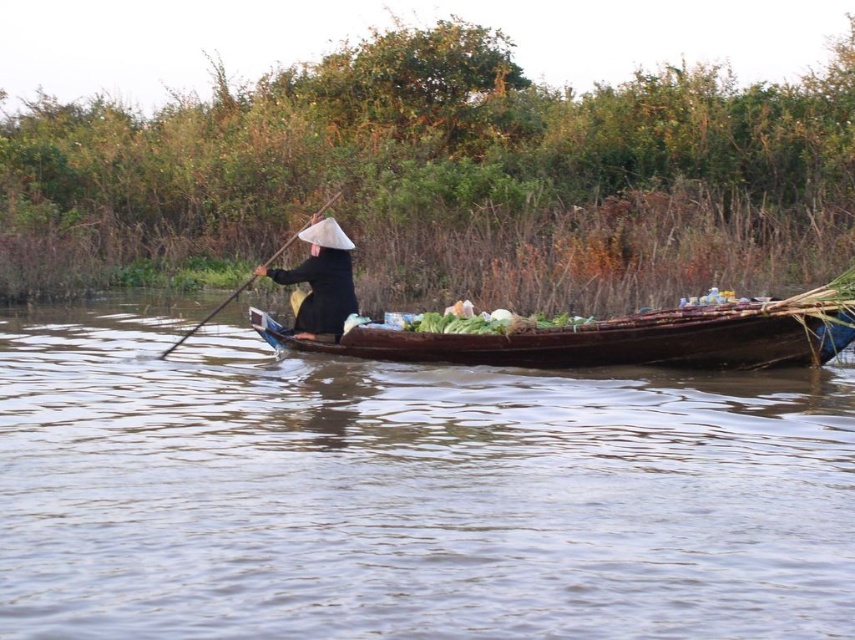
Describe the element at coordinates (405, 490) in the screenshot. I see `brown wooden boat at center` at that location.

Which is below, brown wooden boat at center or green leafy vegetables at center?

Positioned lower is brown wooden boat at center.

Describe the element at coordinates (405, 490) in the screenshot. I see `brown wooden boat at center` at that location.

Where is `brown wooden boat at center`? brown wooden boat at center is located at coordinates (405, 490).

Based on the photo, who is more forward, [310,352] or [432,324]?

Point [432,324]

Does brown wooden canoe at center have a greater height compared to green leafy vegetables at center?

Correct, brown wooden canoe at center is much taller as green leafy vegetables at center.

Between point (711, 324) and point (460, 308), which one is positioned in front?

Point (711, 324) is in front.

At what (x,y) coordinates should I click in order to perform the action: click on brown wooden canoe at center. Please return your answer as a coordinate pair (x, y). The width and height of the screenshot is (855, 640). Looking at the image, I should click on (606, 340).

Is brown wooden canoe at center wider than black matte conical hat at center?

Yes, brown wooden canoe at center is wider than black matte conical hat at center.

Does brown wooden canoe at center appear under black matte conical hat at center?

Correct, brown wooden canoe at center is located below black matte conical hat at center.

Which is in front, point (739, 310) or point (337, 300)?

Point (739, 310)

The image size is (855, 640). I want to click on brown wooden canoe at center, so pyautogui.click(x=606, y=340).